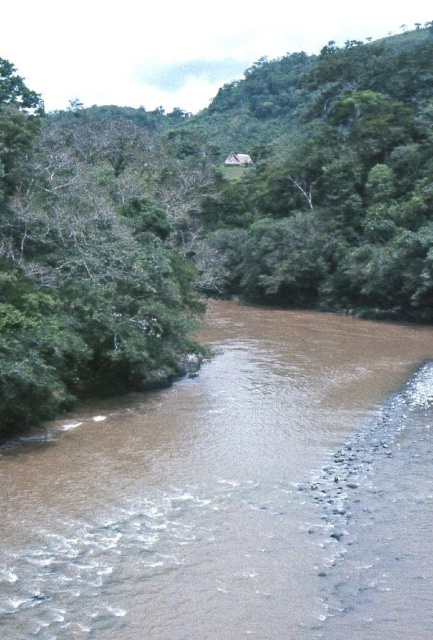
You are a hiker who wants to cross the river using a small wooden bridge that is just wide enough for one person. The bridge is located between the brown muddy water at center and the green leafy tree at center. Can you safely cross the bridge without getting your feet wet?

The brown muddy water at center has a smaller size compared to green leafy tree at center, but the question is about the bridge width. Since the bridge is just wide enough for one person, you can safely cross it as long as you stay centered on the bridge and avoid stepping into the water.